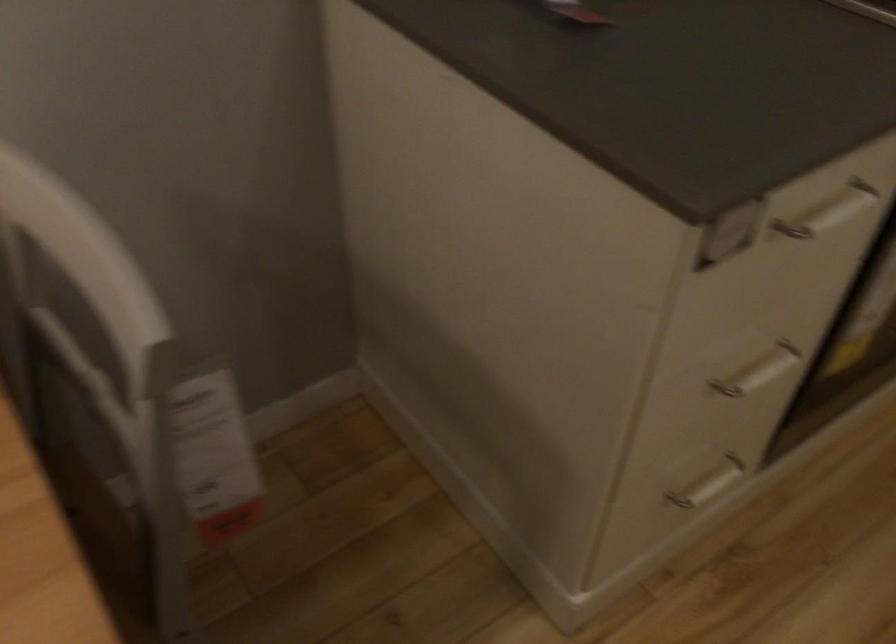
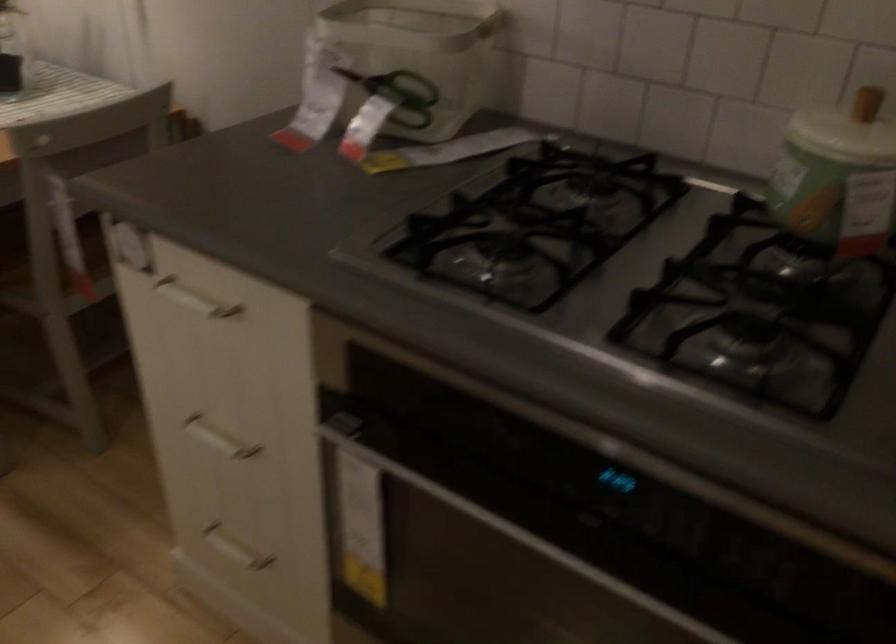
Find the pixel in the second image that matches point (764, 243) in the first image.

(194, 299)